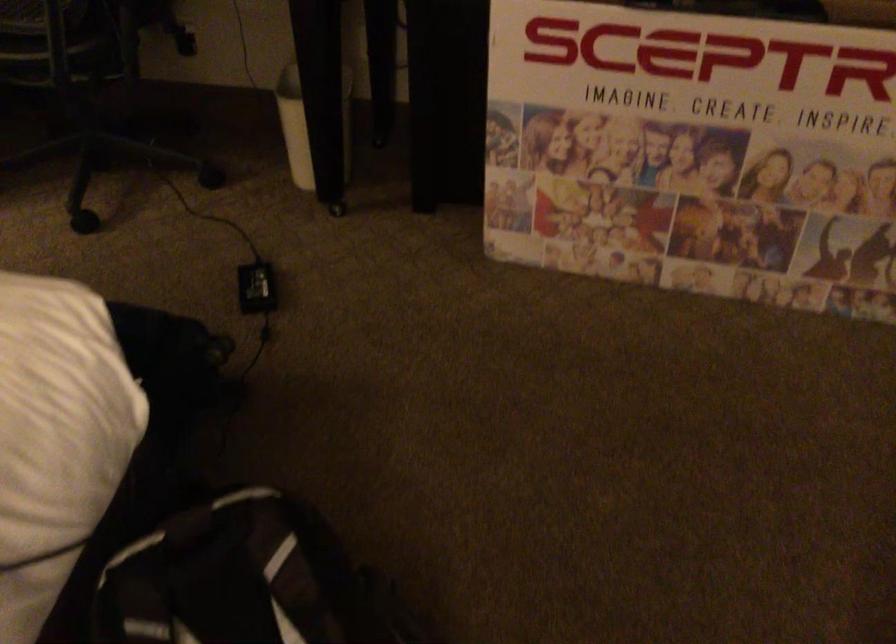
You are a GUI agent. You are given a task and a screenshot of the screen. Output one action in this format:
    pyautogui.click(x=<x>, y=<y>)
    Task: Click on the white trash can
    The height and width of the screenshot is (644, 896).
    Given the screenshot: What is the action you would take?
    pyautogui.click(x=306, y=126)